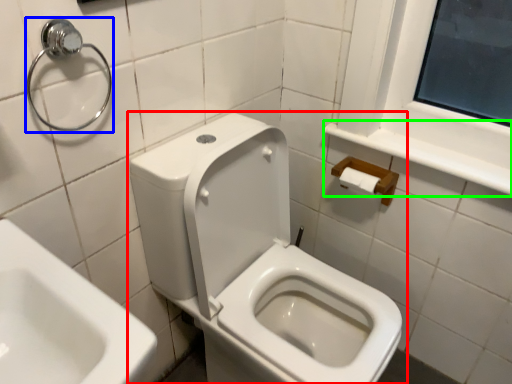
Question: Based on their relative distances, which object is nearer to toilet (highlighted by a red box)? Choose from shower (highlighted by a blue box) and balustrade (highlighted by a green box).

Choices:
 (A) shower
 (B) balustrade

Answer: (B)